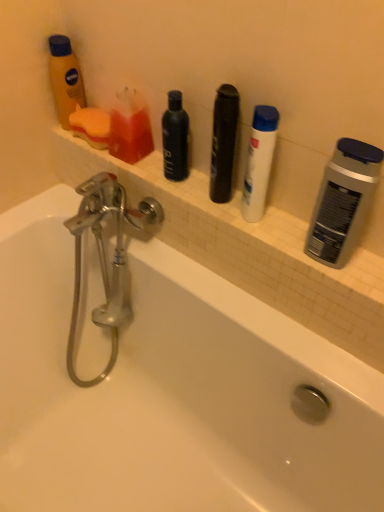
At what (x,y) coordinates should I click in order to perform the action: click on silver metallic deodorant at right, which is the second personal care from left to right. Please return your answer as a coordinate pair (x, y). The image size is (384, 512). Looking at the image, I should click on (343, 202).

What is the approximate width of black matte bottle at center, arranged as the 2th personal care when viewed from the right?

The width of black matte bottle at center, arranged as the 2th personal care when viewed from the right, is 6.48 centimeters.

Describe the element at coordinates (175, 139) in the screenshot. I see `black matte bottle at center, arranged as the 2th personal care when viewed from the right` at that location.

At what (x,y) coordinates should I click in order to perform the action: click on white matte shampoo at center, the third toiletry in the left-to-right sequence. Please return your answer as a coordinate pair (x, y). Looking at the image, I should click on (259, 162).

The image size is (384, 512). Describe the element at coordinates (229, 232) in the screenshot. I see `beige tile ledge at upper center` at that location.

In order to face translucent plastic soap at upper left, positioned as the 2th toiletry in left-to-right order, should I rotate leftwards or rightwards?

It's best to rotate left around 8.474 degrees.

Find the location of a particular element. silver metallic deodorant at right, which is the second personal care from left to right is located at coordinates (343, 202).

Between point (175, 146) and point (71, 93), which one is positioned behind?

The point (71, 93) is more distant.

Based on the photo, how different are the orientations of black matte bottle at center, which is the first personal care from back to front, and matte orange lotion at upper left, marked as the third toiletry in a right-to-left arrangement, in degrees?

0.000796 degrees.

Based on the photo, which of these two, black matte bottle at center, the 2th personal care when ordered from front to back, or matte orange lotion at upper left, marked as the third toiletry in a right-to-left arrangement, stands taller?

matte orange lotion at upper left, marked as the third toiletry in a right-to-left arrangement, is taller.

Between black matte bottle at center, arranged as the 2th personal care when viewed from the right, and matte orange lotion at upper left, which is the 1th toiletry in left-to-right order, which one has larger size?

With larger size is matte orange lotion at upper left, which is the 1th toiletry in left-to-right order.

Is black matte bottle at center, the 2th personal care when ordered from front to back, far away from translucent plastic soap at upper left, placed as the second toiletry when sorted from right to left?

black matte bottle at center, the 2th personal care when ordered from front to back, is near translucent plastic soap at upper left, placed as the second toiletry when sorted from right to left, not far away.

Which object is thinner, black matte bottle at center, which is the first personal care from back to front, or translucent plastic soap at upper left, placed as the second toiletry when sorted from right to left?

black matte bottle at center, which is the first personal care from back to front.

Is black matte bottle at center, arranged as the 2th personal care when viewed from the right, taller than translucent plastic soap at upper left, positioned as the 2th toiletry in left-to-right order?

Yes.

How many degrees apart are the facing directions of black matte bottle at center, the 2th personal care when ordered from front to back, and translucent plastic soap at upper left, positioned as the 2th toiletry in left-to-right order?

There is a 0.00144-degree angle between the facing directions of black matte bottle at center, the 2th personal care when ordered from front to back, and translucent plastic soap at upper left, positioned as the 2th toiletry in left-to-right order.

Could you tell me if white matte shampoo at center, the third toiletry in the left-to-right sequence, is facing silver metallic deodorant at right, placed as the 2th personal care when sorted from back to front?

No, white matte shampoo at center, the third toiletry in the left-to-right sequence, is not oriented towards silver metallic deodorant at right, placed as the 2th personal care when sorted from back to front.

Image resolution: width=384 pixels, height=512 pixels. Find the location of `the 1st toiletry above the silver metallic deodorant at right, placed as the 2th personal care when sorted from back to front (from the image's perspective)`. the 1st toiletry above the silver metallic deodorant at right, placed as the 2th personal care when sorted from back to front (from the image's perspective) is located at coordinates (259, 162).

Between point (270, 121) and point (346, 205), which one is positioned behind?

The point (270, 121) is more distant.

Between white matte shampoo at center, positioned as the first toiletry in right-to-left order, and silver metallic deodorant at right, placed as the first personal care when sorted from right to left, which one appears on the left side from the viewer's perspective?

Positioned to the left is white matte shampoo at center, positioned as the first toiletry in right-to-left order.

I want to click on ledge lying below the translucent plastic soap at upper left, placed as the second toiletry when sorted from right to left (from the image's perspective), so click(x=229, y=232).

Consider the image. Which is more to the left, beige tile ledge at upper center or translucent plastic soap at upper left, placed as the second toiletry when sorted from right to left?

Positioned to the left is translucent plastic soap at upper left, placed as the second toiletry when sorted from right to left.

Between beige tile ledge at upper center and translucent plastic soap at upper left, positioned as the 2th toiletry in left-to-right order, which one has larger size?

Bigger between the two is beige tile ledge at upper center.

Considering the sizes of black matte bottle at center, which is the first personal care from back to front, and white matte shampoo at center, the third toiletry in the left-to-right sequence, in the image, is black matte bottle at center, which is the first personal care from back to front, taller or shorter than white matte shampoo at center, the third toiletry in the left-to-right sequence,?

Considering their sizes, black matte bottle at center, which is the first personal care from back to front, has less height than white matte shampoo at center, the third toiletry in the left-to-right sequence.

Which is in front, point (173, 128) or point (271, 156)?

The point (271, 156) is closer to the camera.

How distant is black matte bottle at center, arranged as the 2th personal care when viewed from the right, from white matte shampoo at center, positioned as the first toiletry in right-to-left order?

black matte bottle at center, arranged as the 2th personal care when viewed from the right, and white matte shampoo at center, positioned as the first toiletry in right-to-left order, are 6.96 inches apart from each other.

Is black matte bottle at center, the 2th personal care when ordered from front to back, directly adjacent to white matte shampoo at center, positioned as the first toiletry in right-to-left order?

No, black matte bottle at center, the 2th personal care when ordered from front to back, is not in contact with white matte shampoo at center, positioned as the first toiletry in right-to-left order.

Is white matte shampoo at center, the third toiletry in the left-to-right sequence, thinner than black matte bottle at center, arranged as the 2th personal care when viewed from the right?

No, white matte shampoo at center, the third toiletry in the left-to-right sequence, is not thinner than black matte bottle at center, arranged as the 2th personal care when viewed from the right.

Looking at this image, looking at the image, does white matte shampoo at center, positioned as the first toiletry in right-to-left order, seem bigger or smaller compared to black matte bottle at center, which is the first personal care from back to front?

Clearly, white matte shampoo at center, positioned as the first toiletry in right-to-left order, is larger in size than black matte bottle at center, which is the first personal care from back to front.

Considering the relative sizes of silver metallic deodorant at right, which is the second personal care from left to right, and beige tile ledge at upper center in the image provided, is silver metallic deodorant at right, which is the second personal care from left to right, shorter than beige tile ledge at upper center?

In fact, silver metallic deodorant at right, which is the second personal care from left to right, may be taller than beige tile ledge at upper center.

Which is correct: silver metallic deodorant at right, which is the second personal care from left to right, is inside beige tile ledge at upper center, or outside of it?

silver metallic deodorant at right, which is the second personal care from left to right, lies outside beige tile ledge at upper center.

Is silver metallic deodorant at right, placed as the first personal care when sorted from right to left, far from beige tile ledge at upper center?

They are positioned close to each other.

Is silver metallic deodorant at right, placed as the first personal care when sorted from right to left, looking in the opposite direction of beige tile ledge at upper center?

No, silver metallic deodorant at right, placed as the first personal care when sorted from right to left, is not facing the opposite direction of beige tile ledge at upper center.

This screenshot has height=512, width=384. In the image, there is a matte orange lotion at upper left, which is the 1th toiletry in left-to-right order. In order to click on personal care below it (from a real-world perspective) in this screenshot , I will do `click(175, 139)`.

The height and width of the screenshot is (512, 384). There is a translucent plastic soap at upper left, positioned as the 2th toiletry in left-to-right order. What are the coordinates of `the 1st personal care above it (from a real-world perspective)` in the screenshot? It's located at (175, 139).

From the image, which object appears to be farther from translucent plastic soap at upper left, positioned as the 2th toiletry in left-to-right order, white matte shampoo at center, the third toiletry in the left-to-right sequence, or silver metallic deodorant at right, placed as the 2th personal care when sorted from back to front?

Based on the image, silver metallic deodorant at right, placed as the 2th personal care when sorted from back to front, appears to be further to translucent plastic soap at upper left, positioned as the 2th toiletry in left-to-right order.

When comparing their distances from beige tile ledge at upper center, does matte orange lotion at upper left, which is the 1th toiletry in left-to-right order, or white matte shampoo at center, positioned as the first toiletry in right-to-left order, seem closer?

white matte shampoo at center, positioned as the first toiletry in right-to-left order, is closer to beige tile ledge at upper center.

Which object lies further to the anchor point beige tile ledge at upper center, white matte shampoo at center, the third toiletry in the left-to-right sequence, or translucent plastic soap at upper left, positioned as the 2th toiletry in left-to-right order?

translucent plastic soap at upper left, positioned as the 2th toiletry in left-to-right order, is positioned further to the anchor beige tile ledge at upper center.

Based on their spatial positions, is black matte bottle at center, arranged as the 2th personal care when viewed from the right, or matte orange lotion at upper left, marked as the third toiletry in a right-to-left arrangement, further from silver metallic deodorant at right, placed as the 2th personal care when sorted from back to front?

matte orange lotion at upper left, marked as the third toiletry in a right-to-left arrangement, is further to silver metallic deodorant at right, placed as the 2th personal care when sorted from back to front.

Considering their positions, is silver metallic deodorant at right, placed as the 2th personal care when sorted from back to front, positioned further to black matte bottle at center, the 2th personal care when ordered from front to back, than beige tile ledge at upper center?

silver metallic deodorant at right, placed as the 2th personal care when sorted from back to front, is positioned further to the anchor black matte bottle at center, the 2th personal care when ordered from front to back.

When comparing their distances from translucent plastic soap at upper left, positioned as the 2th toiletry in left-to-right order, does beige tile ledge at upper center or matte orange lotion at upper left, which is the 1th toiletry in left-to-right order, seem further?

Based on the image, beige tile ledge at upper center appears to be further to translucent plastic soap at upper left, positioned as the 2th toiletry in left-to-right order.

Looking at the image, which one is located further to white matte shampoo at center, positioned as the first toiletry in right-to-left order, matte orange lotion at upper left, which is the 1th toiletry in left-to-right order, or beige tile ledge at upper center?

matte orange lotion at upper left, which is the 1th toiletry in left-to-right order, lies further to white matte shampoo at center, positioned as the first toiletry in right-to-left order, than the other object.

Looking at the image, which one is located further to silver metallic deodorant at right, arranged as the first personal care when viewed from the front, black matte bottle at center, the 2th personal care when ordered from front to back, or beige tile ledge at upper center?

The object further to silver metallic deodorant at right, arranged as the first personal care when viewed from the front, is black matte bottle at center, the 2th personal care when ordered from front to back.

Find the location of a particular element. This screenshot has width=384, height=512. personal care positioned between beige tile ledge at upper center and translucent plastic soap at upper left, positioned as the 2th toiletry in left-to-right order, from near to far is located at coordinates (175, 139).

Locate an element on the screen. ledge located between black matte bottle at center, arranged as the 2th personal care when viewed from the right, and silver metallic deodorant at right, placed as the first personal care when sorted from right to left, in the left-right direction is located at coordinates (229, 232).

Identify the location of toiletry between beige tile ledge at upper center and silver metallic deodorant at right, placed as the 2th personal care when sorted from back to front, in the horizontal direction. This screenshot has height=512, width=384. (259, 162).

Identify the location of toiletry located between matte orange lotion at upper left, marked as the third toiletry in a right-to-left arrangement, and beige tile ledge at upper center in the left-right direction. This screenshot has height=512, width=384. (130, 128).